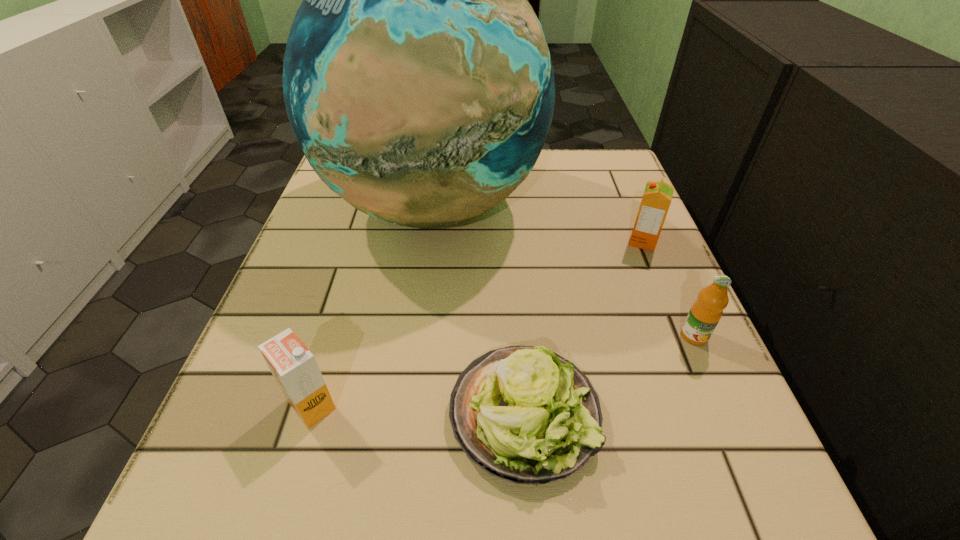
At what (x,y) coordinates should I click in order to perform the action: click on object present at the far edge. Please return your answer as a coordinate pair (x, y). Looking at the image, I should click on (417, 79).

At what (x,y) coordinates should I click in order to perform the action: click on object that is positioned at the near edge. Please return your answer as a coordinate pair (x, y). The width and height of the screenshot is (960, 540). Looking at the image, I should click on (525, 414).

At what (x,y) coordinates should I click in order to perform the action: click on globe present at the left edge. Please return your answer as a coordinate pair (x, y). This screenshot has width=960, height=540. Looking at the image, I should click on (417, 79).

Where is `orange juice that is at the left edge`? orange juice that is at the left edge is located at coordinates (294, 367).

Where is `object that is at the far left corner`? The image size is (960, 540). object that is at the far left corner is located at coordinates (417, 79).

The width and height of the screenshot is (960, 540). Identify the location of blank space at the far edge of the desktop. (538, 178).

The image size is (960, 540). Find the location of `vacant space at the near edge of the desktop`. vacant space at the near edge of the desktop is located at coordinates (624, 466).

At what (x,y) coordinates should I click in order to perform the action: click on blank space at the left edge of the desktop. Please return your answer as a coordinate pair (x, y). Looking at the image, I should click on (302, 245).

This screenshot has height=540, width=960. What are the coordinates of `vacant area at the right edge of the desktop` in the screenshot? It's located at (655, 278).

Image resolution: width=960 pixels, height=540 pixels. In the image, there is a desktop. Identify the location of blank space at the near left corner. (279, 465).